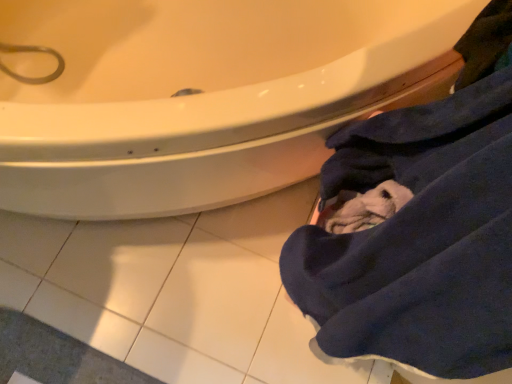
This screenshot has width=512, height=384. Describe the element at coordinates (204, 96) in the screenshot. I see `white glossy sink at upper center` at that location.

At what (x,y) coordinates should I click in order to perform the action: click on white glossy sink at upper center. Please return your answer as a coordinate pair (x, y). Looking at the image, I should click on (204, 96).

Image resolution: width=512 pixels, height=384 pixels. What are the coordinates of `white glossy sink at upper center` in the screenshot? It's located at [204, 96].